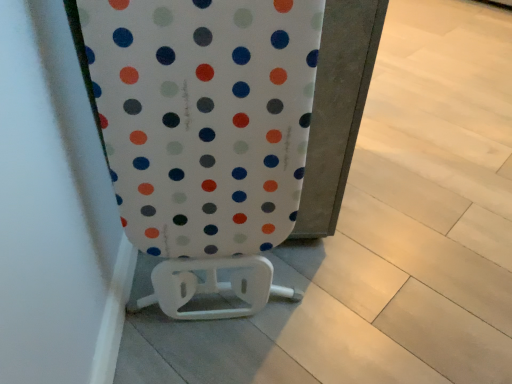
Where is `vacant area that is situated to the right of white plastic toilet at center`? vacant area that is situated to the right of white plastic toilet at center is located at coordinates (358, 293).